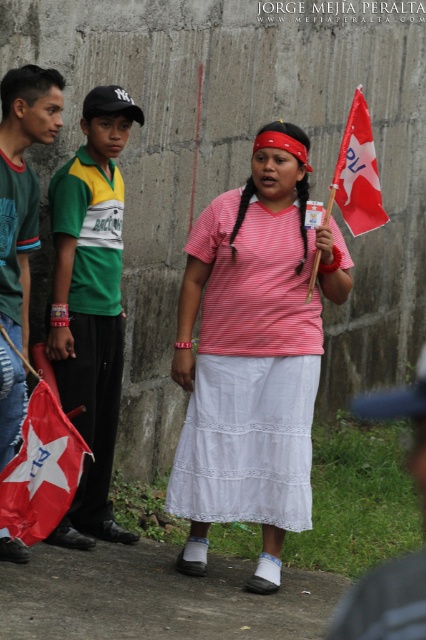
You are a photographer at the event and want to take a photo of the red fabric flag at upper right without the green jersey at left blocking it. What should you do?

Move to the right side so that the green jersey at left is no longer in front of the red fabric flag at upper right. Since the green jersey at left is currently in front of the red fabric flag at upper right, moving to the right would position the photographer to capture the flag without obstruction.

You are attending a public event and notice two participants wearing the pink striped shirt at center and the green jersey at left. Which participant is taller?

The pink striped shirt at center is taller than the green jersey at left.

Based on the scene description, which object is located below the other between the dark gray fabric cap at upper left and the red fabric flag at lower left?

The dark gray fabric cap at upper left is positioned under the red fabric flag at lower left, so the red fabric flag at lower left is above the dark gray fabric cap at upper left.